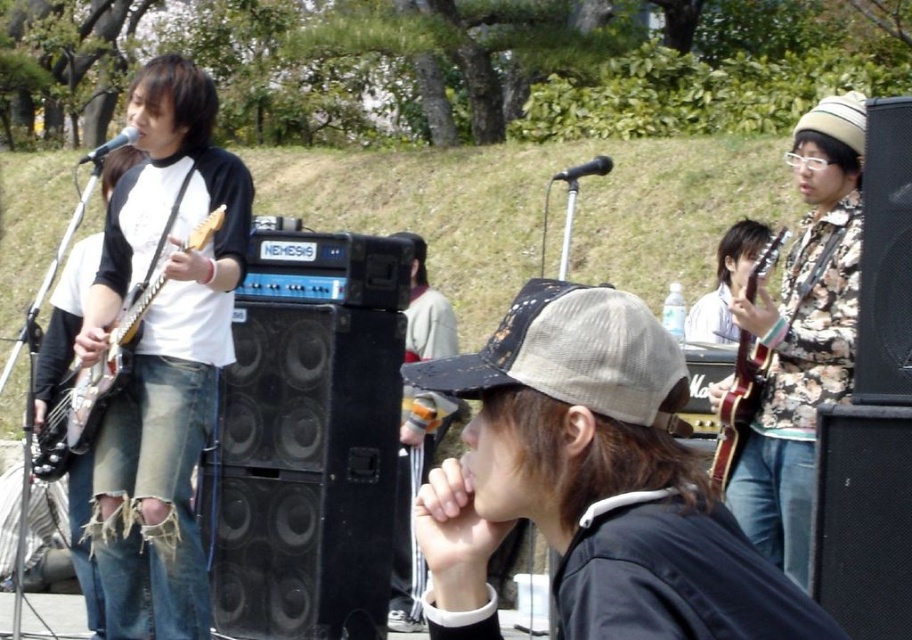
Is point (127, 387) less distant than point (125, 332)?

No, (127, 387) is behind (125, 332).

Is ripped denim jeans at left in front of matte white electric guitar at left?

No, ripped denim jeans at left is behind matte white electric guitar at left.

Where is `ripped denim jeans at left`? The width and height of the screenshot is (912, 640). ripped denim jeans at left is located at coordinates (163, 353).

Between point (838, 260) and point (719, 413), which one is positioned behind?

The point (719, 413) is more distant.

Identify the location of floral-patterned shirt at right. The width and height of the screenshot is (912, 640). (803, 337).

Between point (778, 440) and point (729, 412), which one is positioned behind?

Point (778, 440)

Find the location of `floral-patterned shirt at right`. floral-patterned shirt at right is located at coordinates (803, 337).

Based on the photo, is wooden acoustic guitar at right shorter than matte white electric guitar at left?

Yes.

Is point (739, 433) farther from viewer compared to point (86, 368)?

No.

I want to click on wooden acoustic guitar at right, so click(x=738, y=406).